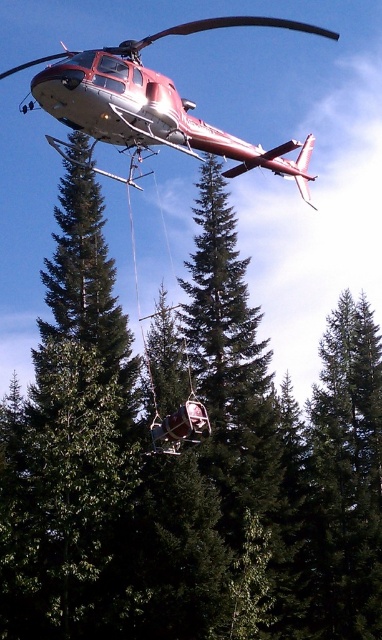
Question: Which of the following is the farthest from the observer?

Choices:
 (A) metallic red helicopter at upper center
 (B) green textured tree at center
 (C) metallic red chair at center
 (D) metallic silver ski lift at center

Answer: (B)

Question: Among these points, which one is farthest from the camera?

Choices:
 (A) (199, 401)
 (B) (87, 316)
 (C) (168, 419)
 (D) (85, 74)

Answer: (B)

Question: Among these objects, which one is farthest from the camera?

Choices:
 (A) metallic red chair at center
 (B) metallic red helicopter at upper center

Answer: (A)

Question: Is metallic red helicopter at upper center to the left of metallic red chair at center from the viewer's perspective?

Choices:
 (A) yes
 (B) no

Answer: (A)

Question: Is metallic red helicopter at upper center bigger than metallic red chair at center?

Choices:
 (A) no
 (B) yes

Answer: (B)

Question: Is metallic silver ski lift at center to the left of metallic red chair at center from the viewer's perspective?

Choices:
 (A) yes
 (B) no

Answer: (A)